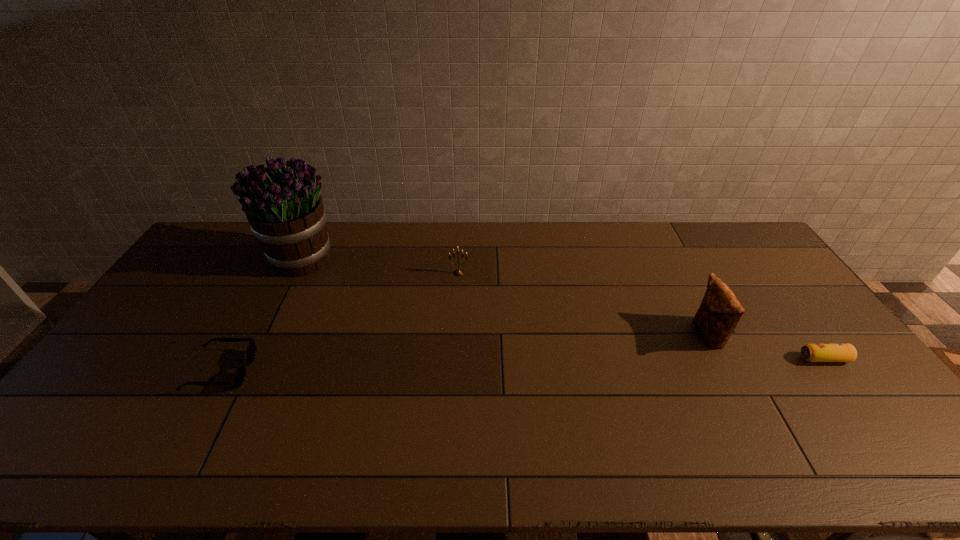
Where is `free spot between the rightmost object and the clutch bag`? free spot between the rightmost object and the clutch bag is located at coordinates (765, 347).

Choose which object is the third nearest neighbor to the sunglasses. Please provide its 2D coordinates. Your answer should be formatted as a tuple, i.e. [(x, y)], where the tuple contains the x and y coordinates of a point satisfying the conditions above.

[(719, 313)]

This screenshot has height=540, width=960. I want to click on object that ranks as the second closest to the tallest object, so click(x=458, y=272).

Locate an element on the screen. The image size is (960, 540). free region that satisfies the following two spatial constraints: 1. on the front side of the third object from left to right; 2. on the right side of the tallest object is located at coordinates (297, 273).

Where is `free location that satisfies the following two spatial constraints: 1. on the front side of the beer can; 2. on the left side of the tallest object`? free location that satisfies the following two spatial constraints: 1. on the front side of the beer can; 2. on the left side of the tallest object is located at coordinates (255, 359).

I want to click on free spot that satisfies the following two spatial constraints: 1. on the back side of the rightmost object; 2. on the open side of the clutch bag, so click(806, 335).

Where is `blank space that satisfies the following two spatial constraints: 1. on the front side of the rightmost object; 2. at the front lenses of the sunglasses`? The height and width of the screenshot is (540, 960). blank space that satisfies the following two spatial constraints: 1. on the front side of the rightmost object; 2. at the front lenses of the sunglasses is located at coordinates (833, 370).

You are a GUI agent. You are given a task and a screenshot of the screen. Output one action in this format:
    pyautogui.click(x=<x>, y=<y>)
    Task: Click on the vacant space that satisfies the following two spatial constraints: 1. on the open side of the beer can; 2. on the left side of the second tallest object
    The height and width of the screenshot is (540, 960).
    Given the screenshot: What is the action you would take?
    pyautogui.click(x=719, y=359)